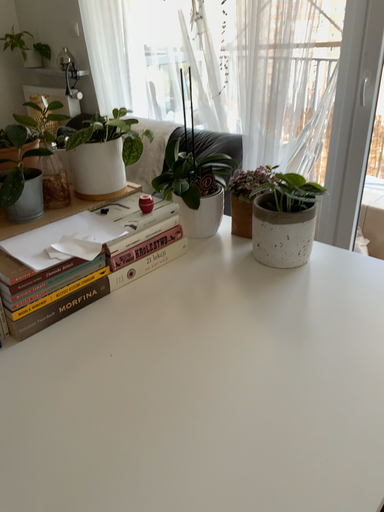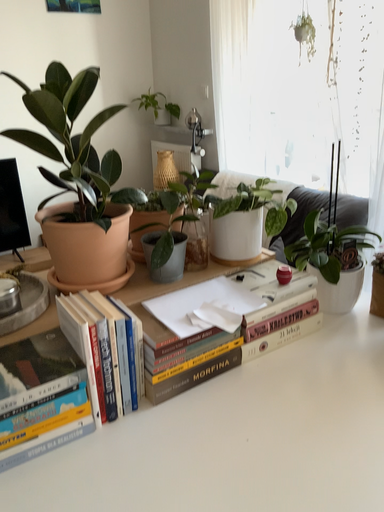
Question: Which way did the camera rotate in the video?

Choices:
 (A) rotated left
 (B) rotated right

Answer: (A)